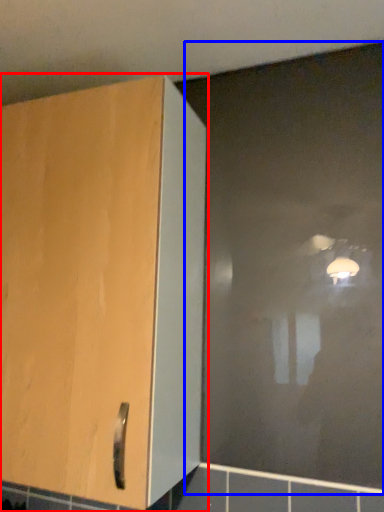
Question: Among these objects, which one is farthest to the camera, cupboard (highlighted by a red box) or glass door (highlighted by a blue box)?

Choices:
 (A) cupboard
 (B) glass door

Answer: (B)